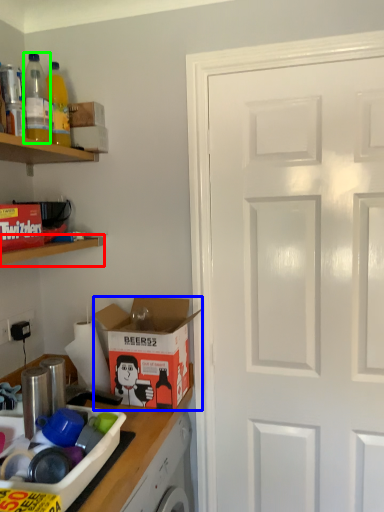
Question: Which object is the farthest from shelf (highlighted by a red box)? Choose among these: cardboard box (highlighted by a blue box) or bottle (highlighted by a green box).

Choices:
 (A) cardboard box
 (B) bottle

Answer: (B)